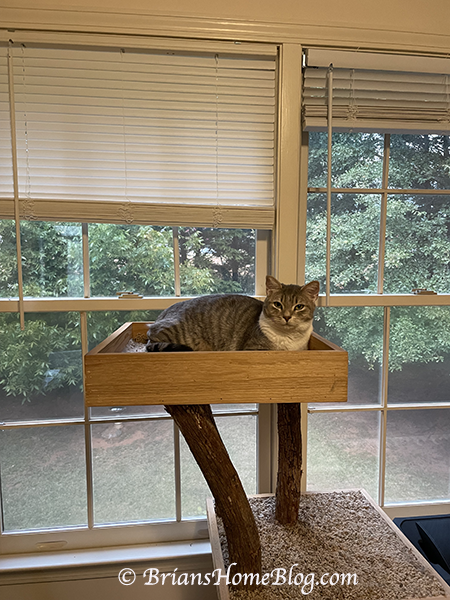
At what (x,y) coordinates should I click in order to perform the action: click on white fur. Please return your answer as a coordinate pair (x, y). Looking at the image, I should click on (282, 338), (291, 321), (283, 320).